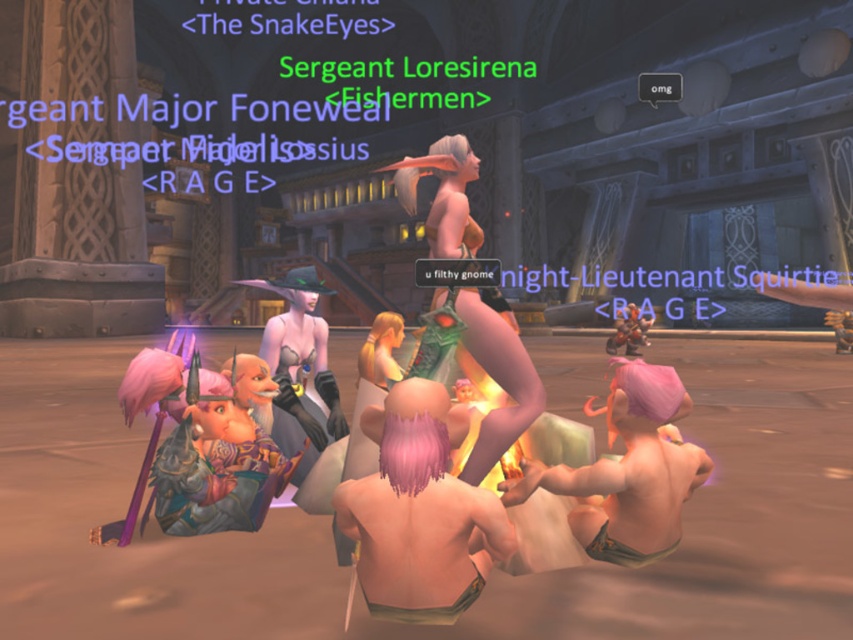
Can you confirm if green leather armor at center is positioned to the right of blonde hair at center?

Indeed, green leather armor at center is positioned on the right side of blonde hair at center.

Is green leather armor at center thinner than blonde hair at center?

No, green leather armor at center is not thinner than blonde hair at center.

Is point (479, 304) closer to viewer compared to point (369, 365)?

Yes.

Image resolution: width=853 pixels, height=640 pixels. I want to click on green leather armor at center, so click(x=497, y=381).

Is shiny purple armor at center wider than green leather armor at center?

In fact, shiny purple armor at center might be narrower than green leather armor at center.

Locate an element on the screen. The image size is (853, 640). shiny purple armor at center is located at coordinates (215, 465).

This screenshot has height=640, width=853. I want to click on shiny purple armor at center, so click(215, 465).

Which is in front, point (384, 518) or point (360, 362)?

Positioned in front is point (384, 518).

Which is more to the right, pink hair at center or blonde hair at center?

pink hair at center is more to the right.

Between point (374, 522) and point (381, 337), which one is positioned behind?

Positioned behind is point (381, 337).

Locate an element on the screen. pink hair at center is located at coordinates (419, 515).